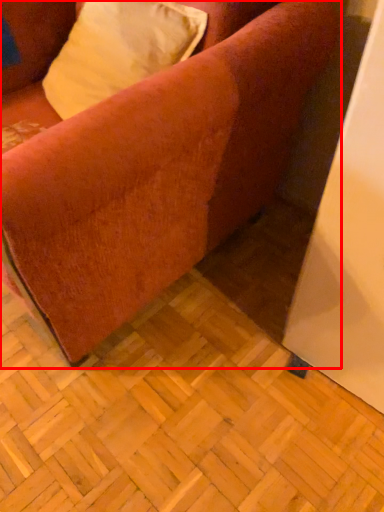
Question: Considering the relative positions of studio couch (annotated by the red box) and pillow in the image provided, where is studio couch (annotated by the red box) located with respect to the staircase?

Choices:
 (A) left
 (B) right

Answer: (A)